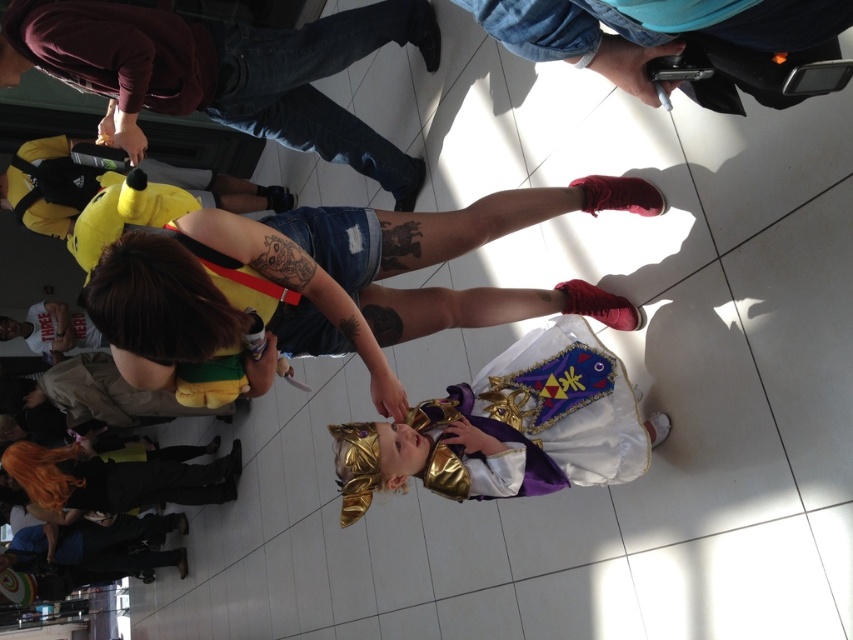
Question: Does yellow plush toy at left lie in front of red suede shoe at lower center?

Choices:
 (A) no
 (B) yes

Answer: (A)

Question: Based on their relative distances, which object is nearer to the white fabric sock at lower center?

Choices:
 (A) yellow plush toy at lower left
 (B) denim shorts at center

Answer: (B)

Question: Which object is the closest to the yellow plush toy at left?

Choices:
 (A) blue denim jeans at upper center
 (B) red suede shoe at lower right
 (C) purple satin cape at center
 (D) white fabric sock at lower center

Answer: (C)

Question: Which point is closer to the camera?

Choices:
 (A) red suede shoe at lower right
 (B) purple satin cape at center
 (C) red suede shoe at lower center

Answer: (B)

Question: Is denim shorts at center thinner than yellow plush toy at left?

Choices:
 (A) yes
 (B) no

Answer: (B)

Question: Observing the image, what is the correct spatial positioning of yellow plush toy at lower left in reference to yellow plush toy at left?

Choices:
 (A) above
 (B) below

Answer: (A)